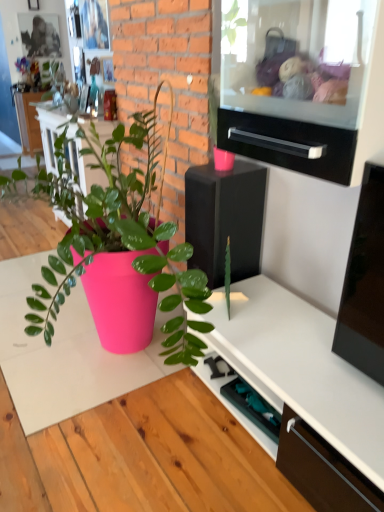
Question: Can you confirm if black glossy speaker at center is thinner than black glossy drawer at upper center?

Choices:
 (A) no
 (B) yes

Answer: (A)

Question: From the image's perspective, is black glossy speaker at center beneath black glossy drawer at upper center?

Choices:
 (A) yes
 (B) no

Answer: (A)

Question: Considering the relative sizes of black glossy speaker at center and black glossy drawer at upper center in the image provided, is black glossy speaker at center bigger than black glossy drawer at upper center?

Choices:
 (A) yes
 (B) no

Answer: (A)

Question: From a real-world perspective, does black glossy speaker at center sit lower than black glossy drawer at upper center?

Choices:
 (A) no
 (B) yes

Answer: (B)

Question: From the image's perspective, would you say black glossy speaker at center is positioned over black glossy drawer at upper center?

Choices:
 (A) yes
 (B) no

Answer: (B)

Question: Considering the relative sizes of black glossy speaker at center and black glossy drawer at upper center in the image provided, is black glossy speaker at center shorter than black glossy drawer at upper center?

Choices:
 (A) yes
 (B) no

Answer: (B)

Question: Is black glossy drawer at upper center facing away from black glossy speaker at center?

Choices:
 (A) no
 (B) yes

Answer: (A)

Question: Is black glossy drawer at upper center placed right next to black glossy speaker at center?

Choices:
 (A) no
 (B) yes

Answer: (A)

Question: Can you confirm if black glossy drawer at upper center is wider than black glossy speaker at center?

Choices:
 (A) no
 (B) yes

Answer: (A)

Question: Is black glossy drawer at upper center to the left of black glossy speaker at center from the viewer's perspective?

Choices:
 (A) yes
 (B) no

Answer: (B)

Question: Does black glossy drawer at upper center have a lesser width compared to black glossy speaker at center?

Choices:
 (A) yes
 (B) no

Answer: (A)

Question: Does black glossy drawer at upper center come in front of black glossy speaker at center?

Choices:
 (A) yes
 (B) no

Answer: (A)

Question: In the image, is black glossy speaker at center positioned in front of or behind black glossy drawer at upper center?

Choices:
 (A) behind
 (B) front

Answer: (A)